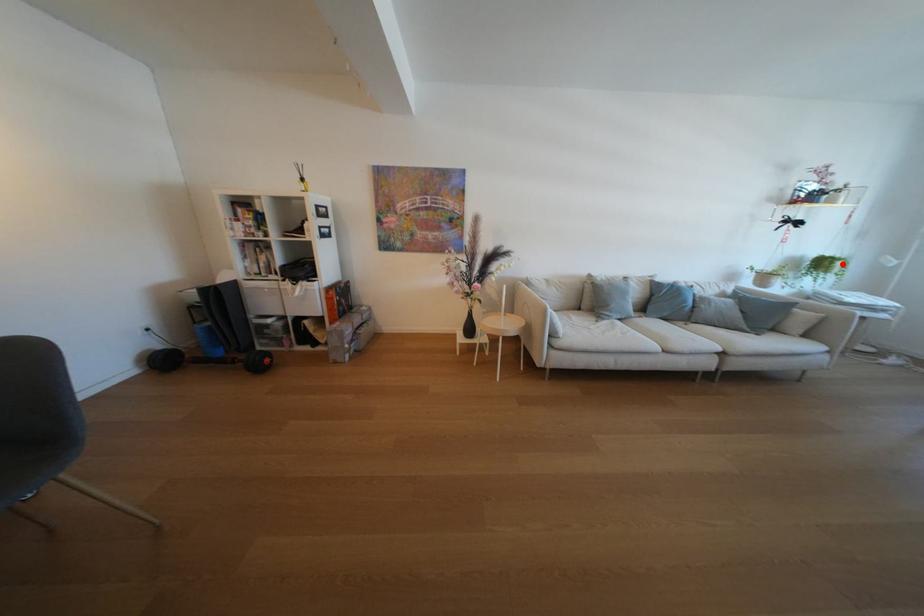
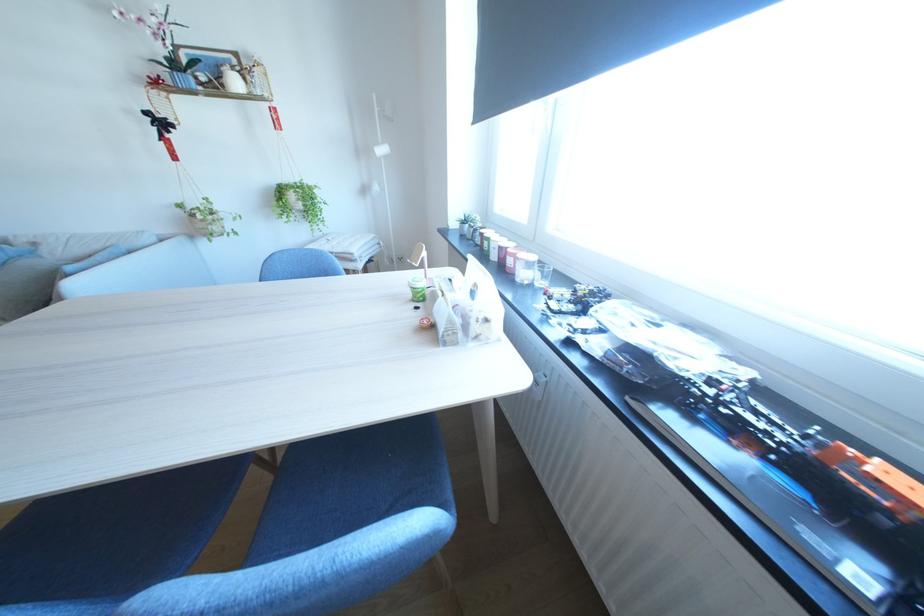
Question: A red point is marked in image1. In image2, is the corresponding 3D point closer to the camera or farther? Reply with the corresponding letter.

Choices:
 (A) The corresponding 3D point is closer.
 (B) The corresponding 3D point is farther.

Answer: (A)